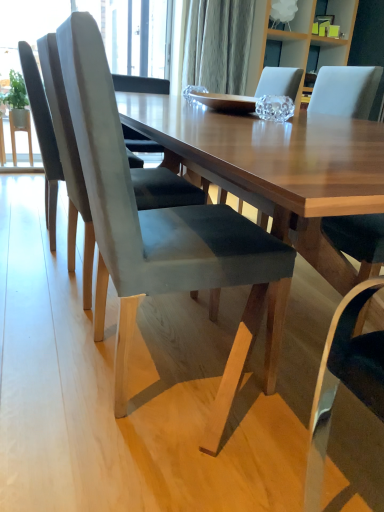
You are a GUI agent. You are given a task and a screenshot of the screen. Output one action in this format:
    pyautogui.click(x=<x>, y=<y>)
    Task: Click on the vacant region to the right of suede gray chair at center, acting as the third chair starting from the back
    
    Given the screenshot: What is the action you would take?
    pyautogui.click(x=315, y=413)